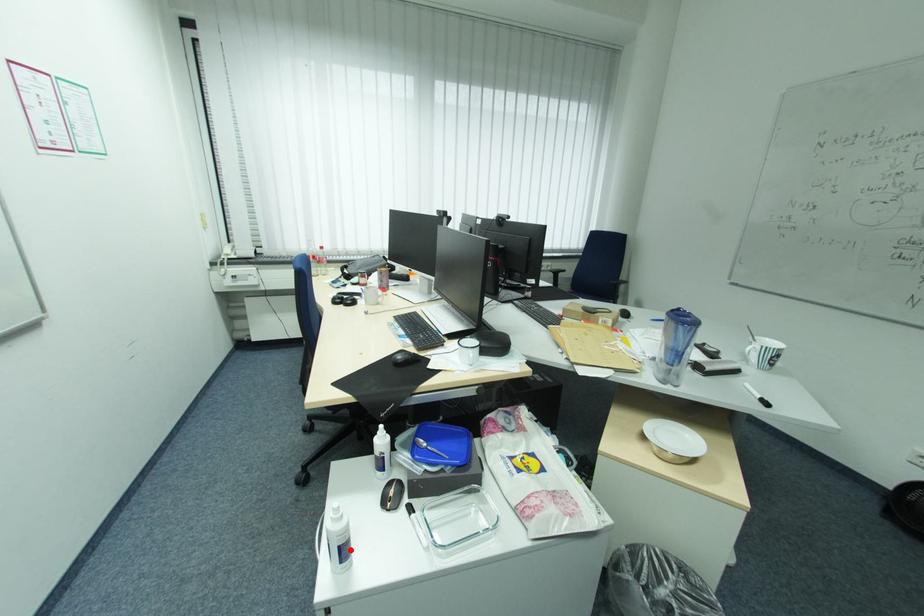
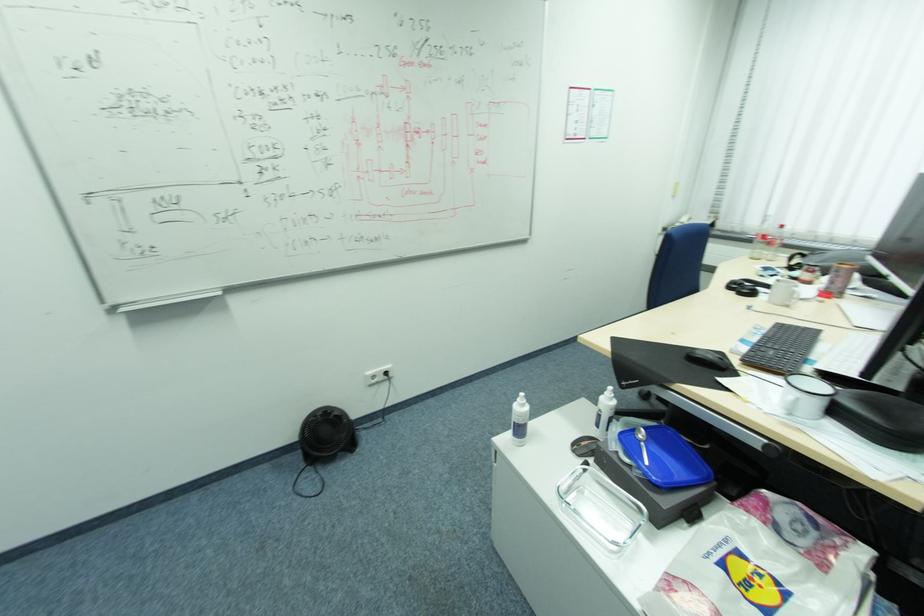
Find the pixel in the second image that matches the highlighted location in the first image.

(526, 430)